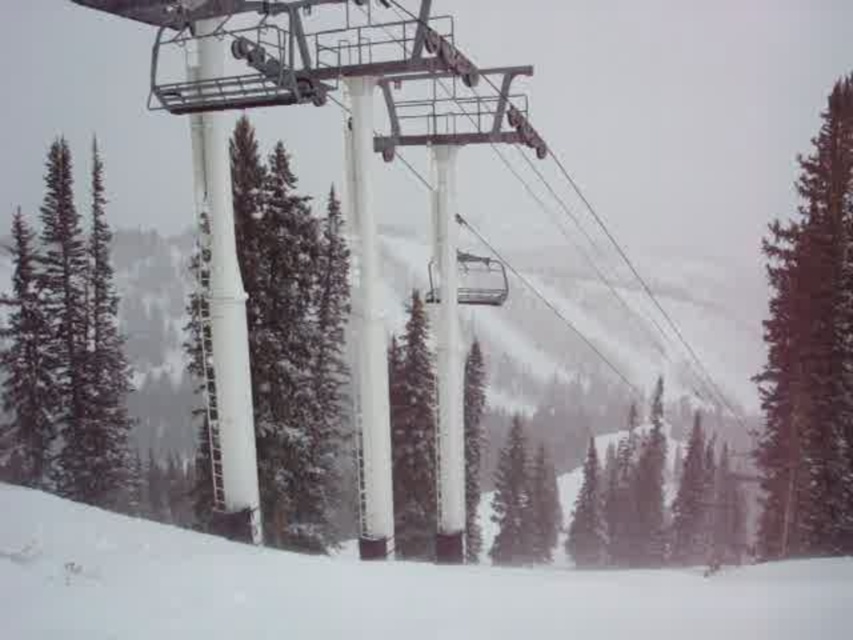
Can you confirm if green matte evergreen tree at left is wider than green matte tree at center?

Correct, the width of green matte evergreen tree at left exceeds that of green matte tree at center.

Who is more forward, (42, 440) or (585, 499)?

Positioned in front is point (42, 440).

Does point (19, 314) come in front of point (576, 566)?

Yes, it is in front of point (576, 566).

The width and height of the screenshot is (853, 640). In order to click on green matte evergreen tree at left in this screenshot , I will do `click(68, 342)`.

Who is positioned more to the left, snow-covered pine tree at right or green matte evergreen tree at left?

green matte evergreen tree at left is more to the left.

Can you confirm if snow-covered pine tree at right is positioned to the right of green matte evergreen tree at left?

Indeed, snow-covered pine tree at right is positioned on the right side of green matte evergreen tree at left.

Does point (787, 337) come farther from viewer compared to point (62, 268)?

No, (787, 337) is closer to viewer.

Where is `snow-covered pine tree at right`? The height and width of the screenshot is (640, 853). snow-covered pine tree at right is located at coordinates (810, 349).

Does white matte pole at center come in front of snow-covered pine tree at right?

Yes, it is.

Looking at this image, how far apart are white matte pole at center and snow-covered pine tree at right?

They are 138.46 feet apart.

Is point (317, 230) positioned behind point (831, 172)?

Yes, point (317, 230) is farther from viewer.

You are a GUI agent. You are given a task and a screenshot of the screen. Output one action in this format:
    pyautogui.click(x=<x>, y=<y>)
    Task: Click on the white matte pole at center
    Image resolution: width=853 pixels, height=640 pixels.
    Given the screenshot: What is the action you would take?
    pyautogui.click(x=289, y=339)